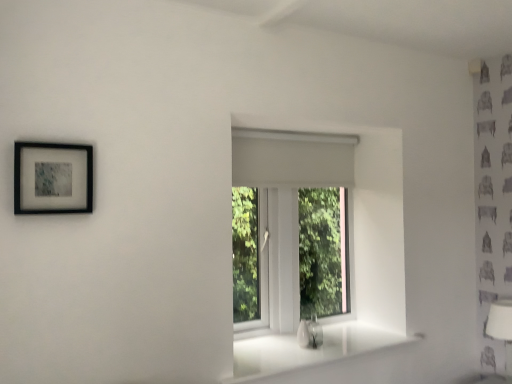
Identify the location of white matte window at center. The width and height of the screenshot is (512, 384). (285, 204).

What do you see at coordinates (285, 204) in the screenshot? I see `white matte window at center` at bounding box center [285, 204].

The image size is (512, 384). Describe the element at coordinates (53, 178) in the screenshot. I see `black matte picture frame at upper left` at that location.

Identify the location of white matte window at center. The height and width of the screenshot is (384, 512). (285, 204).

Can black matte picture frame at upper left be found inside white fabric lampshade at lower right?

No, black matte picture frame at upper left is not a part of white fabric lampshade at lower right.

Considering the positions of objects white fabric lampshade at lower right and black matte picture frame at upper left in the image provided, who is more to the right, white fabric lampshade at lower right or black matte picture frame at upper left?

Positioned to the right is white fabric lampshade at lower right.

Can you tell me how much white fabric lampshade at lower right and black matte picture frame at upper left differ in facing direction?

The angular difference between white fabric lampshade at lower right and black matte picture frame at upper left is 91.7 degrees.

Is black matte picture frame at upper left at the back of white fabric lampshade at lower right?

No, white fabric lampshade at lower right's orientation is not away from black matte picture frame at upper left.

Would you say white glossy sink at lower center contains white fabric lampshade at lower right?

No, white fabric lampshade at lower right is not a part of white glossy sink at lower center.

Is white glossy sink at lower center turned away from white fabric lampshade at lower right?

No, white glossy sink at lower center's orientation is not away from white fabric lampshade at lower right.

Can you confirm if white glossy sink at lower center is smaller than white fabric lampshade at lower right?

Yes.

How different are the orientations of white glossy sink at lower center and white fabric lampshade at lower right in degrees?

The facing directions of white glossy sink at lower center and white fabric lampshade at lower right are 95 degrees apart.

Between black matte picture frame at upper left and white glossy window sill at center, which one appears on the right side from the viewer's perspective?

Positioned to the right is white glossy window sill at center.

Considering the sizes of black matte picture frame at upper left and white glossy window sill at center in the image, is black matte picture frame at upper left taller or shorter than white glossy window sill at center?

Considering their sizes, black matte picture frame at upper left has more height than white glossy window sill at center.

Considering the positions of objects black matte picture frame at upper left and white glossy window sill at center in the image provided, who is behind, black matte picture frame at upper left or white glossy window sill at center?

white glossy window sill at center is more distant.

From the image's perspective, is black matte picture frame at upper left beneath white glossy window sill at center?

Incorrect, from the image's perspective, black matte picture frame at upper left is higher than white glossy window sill at center.

Considering their positions, is white glossy sink at lower center located in front of or behind white matte window at center?

Clearly, white glossy sink at lower center is in front of white matte window at center.

Can we say white glossy sink at lower center lies outside white matte window at center?

Yes, white glossy sink at lower center is not within white matte window at center.

Can you confirm if white glossy sink at lower center is thinner than white matte window at center?

Indeed, white glossy sink at lower center has a lesser width compared to white matte window at center.

Consider the image. From a real-world perspective, which is physically above, white glossy sink at lower center or white matte window at center?

white matte window at center.

From the image's perspective, which is above, black matte picture frame at upper left or white glossy sink at lower center?

black matte picture frame at upper left is shown above in the image.

Is black matte picture frame at upper left at the right side of white glossy sink at lower center?

No, black matte picture frame at upper left is not to the right of white glossy sink at lower center.

How distant is black matte picture frame at upper left from white glossy sink at lower center?

The distance of black matte picture frame at upper left from white glossy sink at lower center is 1.43 meters.

Does black matte picture frame at upper left have a lesser width compared to white glossy sink at lower center?

Correct, the width of black matte picture frame at upper left is less than that of white glossy sink at lower center.

Is white matte window at center completely or partially outside of white fabric lampshade at lower right?

white matte window at center is positioned outside white fabric lampshade at lower right.

Is white matte window at center oriented away from white fabric lampshade at lower right?

No.

In the scene shown: How distant is white matte window at center from white fabric lampshade at lower right?

The distance of white matte window at center from white fabric lampshade at lower right is 1.26 meters.

Is white matte window at center positioned before white fabric lampshade at lower right?

No, white matte window at center is further to the viewer.

Which object is further away from the camera taking this photo, white fabric lampshade at lower right or white glossy window sill at center?

white fabric lampshade at lower right is further from the camera.

Is white fabric lampshade at lower right aimed at white glossy window sill at center?

No, white fabric lampshade at lower right does not turn towards white glossy window sill at center.

You are a GUI agent. You are given a task and a screenshot of the screen. Output one action in this format:
    pyautogui.click(x=<x>, y=<y>)
    Task: Click on the window sill that is in front of the white fabric lampshade at lower right
    
    Given the screenshot: What is the action you would take?
    pyautogui.click(x=308, y=350)

From the image's perspective, would you say white fabric lampshade at lower right is shown under white glossy window sill at center?

Yes, from the image's perspective, white fabric lampshade at lower right is beneath white glossy window sill at center.

Image resolution: width=512 pixels, height=384 pixels. What are the coordinates of `picture frame above the white fabric lampshade at lower right (from a real-world perspective)` in the screenshot? It's located at tap(53, 178).

You are a GUI agent. You are given a task and a screenshot of the screen. Output one action in this format:
    pyautogui.click(x=<x>, y=<y>)
    Task: Click on the table lamp that appears in front of the white glossy sink at lower center
    The image size is (512, 384).
    Given the screenshot: What is the action you would take?
    pyautogui.click(x=502, y=329)

From the image, which object appears to be nearer to white glossy sink at lower center, white glossy window sill at center or black matte picture frame at upper left?

white glossy window sill at center is closer to white glossy sink at lower center.

Based on their spatial positions, is white glossy window sill at center or white glossy sink at lower center closer to white matte window at center?

The object closer to white matte window at center is white glossy window sill at center.

Looking at the image, which one is located further to white glossy sink at lower center, white glossy window sill at center or white matte window at center?

Based on the image, white matte window at center appears to be further to white glossy sink at lower center.

When comparing their distances from white glossy sink at lower center, does black matte picture frame at upper left or white fabric lampshade at lower right seem closer?

The object closer to white glossy sink at lower center is white fabric lampshade at lower right.

Based on their spatial positions, is black matte picture frame at upper left or white glossy window sill at center closer to white fabric lampshade at lower right?

Among the two, white glossy window sill at center is located nearer to white fabric lampshade at lower right.

Based on their spatial positions, is white glossy window sill at center or white fabric lampshade at lower right further from black matte picture frame at upper left?

white fabric lampshade at lower right is further to black matte picture frame at upper left.

From the image, which object appears to be nearer to black matte picture frame at upper left, white glossy window sill at center or white matte window at center?

white matte window at center is closer to black matte picture frame at upper left.

Which object lies further to the anchor point white matte window at center, black matte picture frame at upper left or white fabric lampshade at lower right?

Among the two, white fabric lampshade at lower right is located further to white matte window at center.

At what (x,y) coordinates should I click in order to perform the action: click on sink between white matte window at center and white glossy window sill at center in the vertical direction. Please return your answer as a coordinate pair (x, y). Looking at the image, I should click on (310, 333).

Locate an element on the screen. This screenshot has height=384, width=512. window sill between white glossy sink at lower center and white fabric lampshade at lower right is located at coordinates (308, 350).

Identify the location of window sill between black matte picture frame at upper left and white fabric lampshade at lower right. (308, 350).

Where is `sink between black matte picture frame at upper left and white glossy window sill at center`? The height and width of the screenshot is (384, 512). sink between black matte picture frame at upper left and white glossy window sill at center is located at coordinates (310, 333).